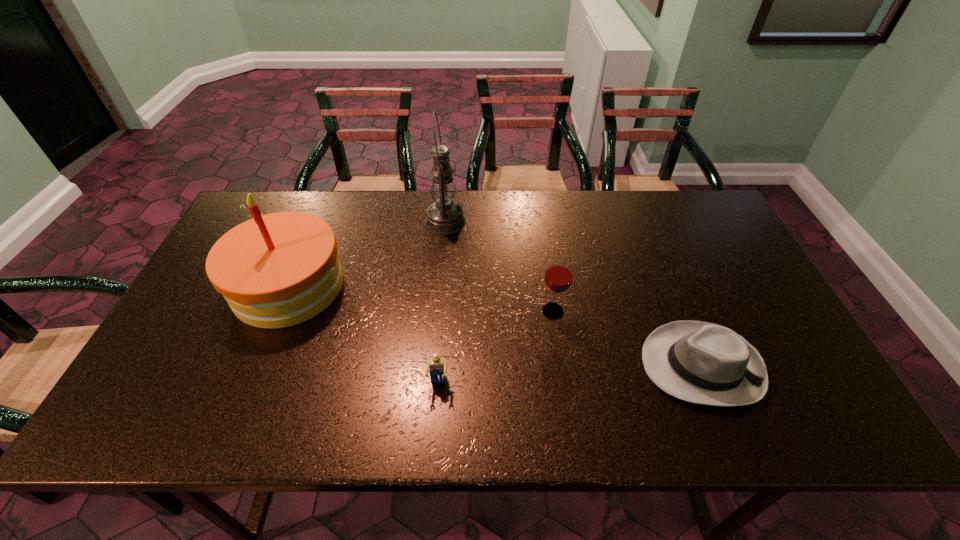
The height and width of the screenshot is (540, 960). I want to click on the farthest object, so click(x=445, y=216).

Locate an element on the screen. The height and width of the screenshot is (540, 960). birthday cake is located at coordinates (276, 270).

Find the location of a particular element. The height and width of the screenshot is (540, 960). the fourth shortest object is located at coordinates (276, 270).

Identify the location of the third tallest object. (558, 278).

Identify the location of the second object from right to left. The image size is (960, 540). (558, 278).

Identify the location of the rightmost object. (704, 363).

Where is `Lego`? Image resolution: width=960 pixels, height=540 pixels. Lego is located at coordinates (436, 366).

This screenshot has width=960, height=540. Find the location of `vacant space located 0.070m on the back of the farthest object`. vacant space located 0.070m on the back of the farthest object is located at coordinates (447, 197).

You are a GUI agent. You are given a task and a screenshot of the screen. Output one action in this format:
    pyautogui.click(x=<x>, y=<y>)
    Task: Click on the vacant region located on the front of the leftmost object
    This screenshot has height=540, width=960.
    Given the screenshot: What is the action you would take?
    point(231,426)

Find the location of `free location located 0.220m on the front of the third shortest object`. free location located 0.220m on the front of the third shortest object is located at coordinates (565, 399).